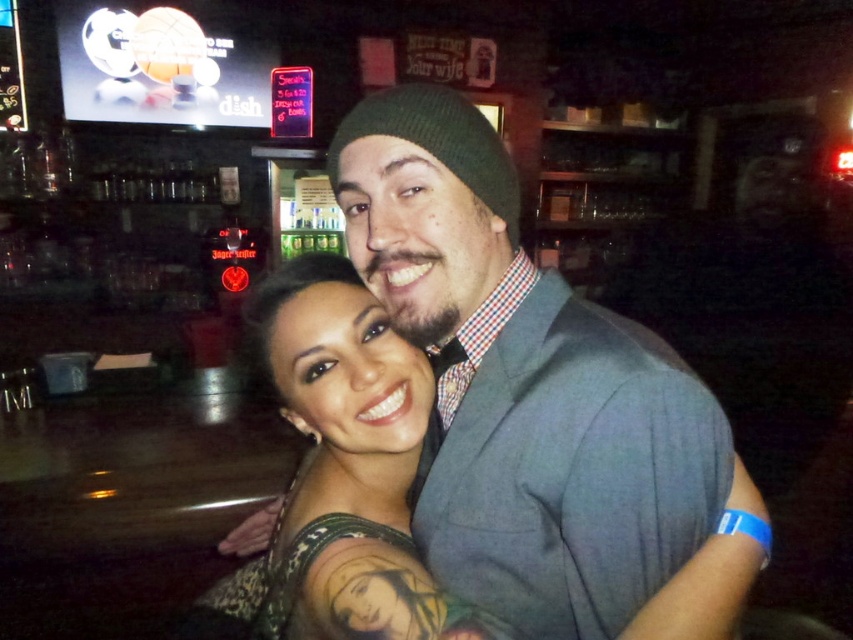
You are standing in a bar and want to place a 70 cm wide painting between the man and the woman in the image. The point where you want to hang the painting is located at point coordinates [495,166]. Can the painting fit in that space?

The distance between point [495,166] and the viewer is 72.88 centimeters. Since the painting is 70 cm wide, it can fit in the space as it is slightly narrower than the available distance.

You are a photographer adjusting your camera settings to focus on the subjects in the bar scene. Which object, the matte gray suit at center or the dark skin tattoo at center, is positioned higher in the image?

The matte gray suit at center is above the dark skin tattoo at center, so it is positioned higher in the image.

You are taking a photo of the scene and want to focus on both the man and the woman. The man is at point (535, 464) and the woman is at point (340, 310). Since the camera can only focus on one depth plane, which point should you choose to ensure the closer subject is in focus?

Point (535, 464) is closer to the camera than point (340, 310), so you should focus on that point to ensure the closer subject is in focus.